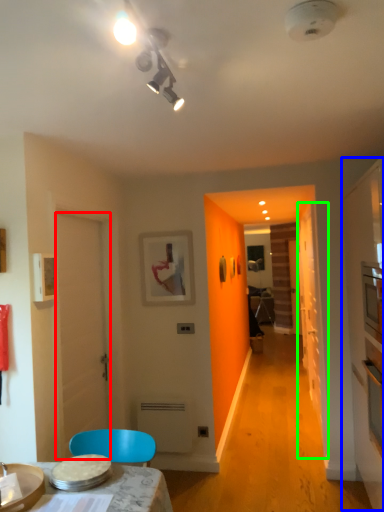
Question: Which object is the closest to the door (highlighted by a red box)? Choose among these: dresser (highlighted by a blue box) or glass door (highlighted by a green box).

Choices:
 (A) dresser
 (B) glass door

Answer: (A)